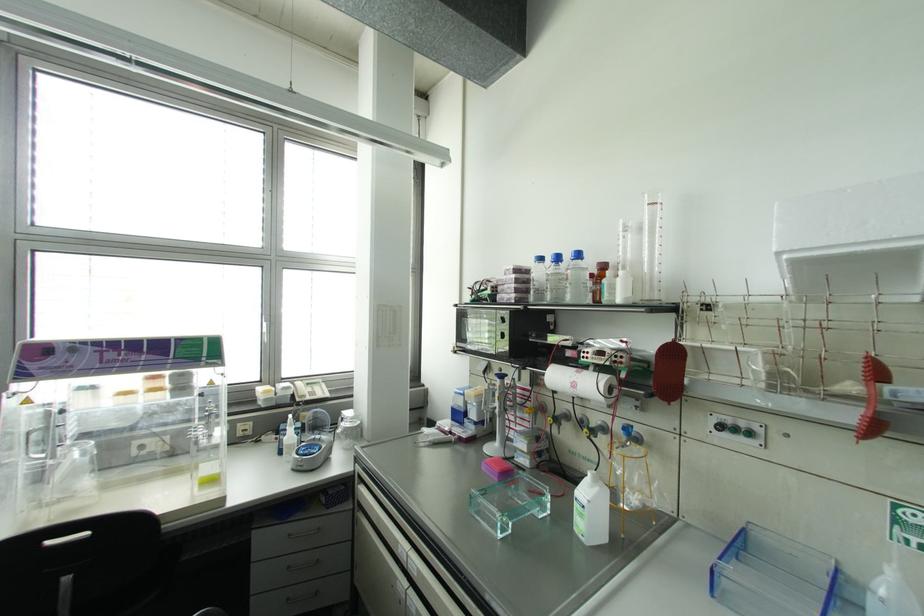
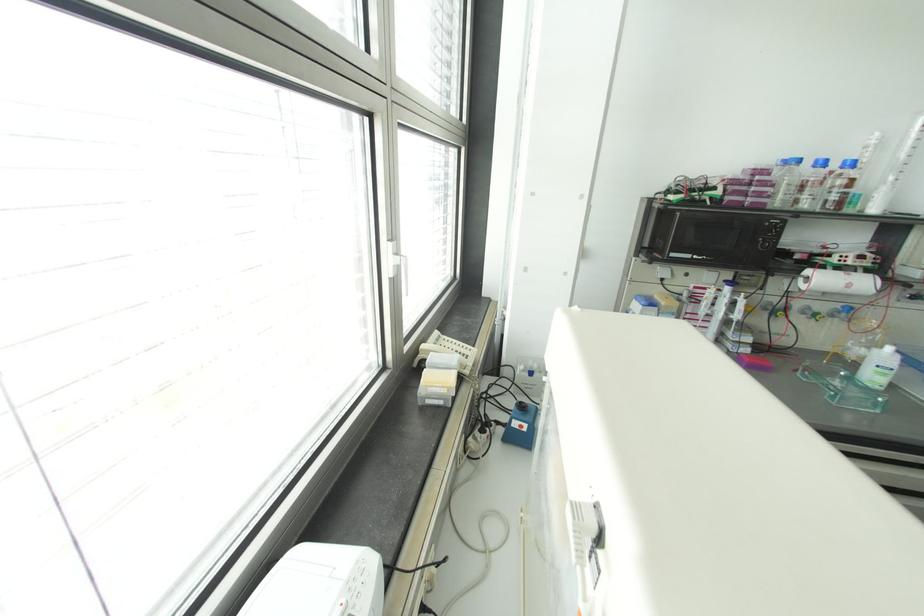
The point at [596,488] is marked in the first image. Where is the corresponding point in the second image?

(898, 355)